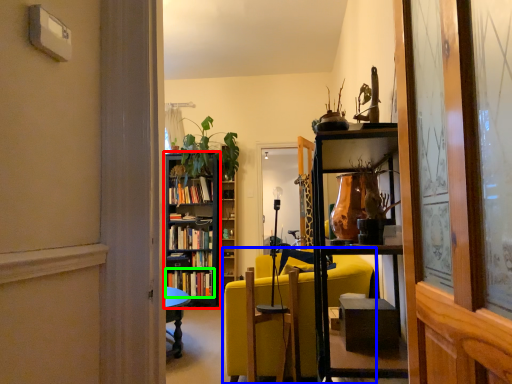
Question: Considering the real-world distances, which object is farthest from bookcase (highlighted by a red box)? studio couch (highlighted by a blue box) or book (highlighted by a green box)?

Choices:
 (A) studio couch
 (B) book

Answer: (A)